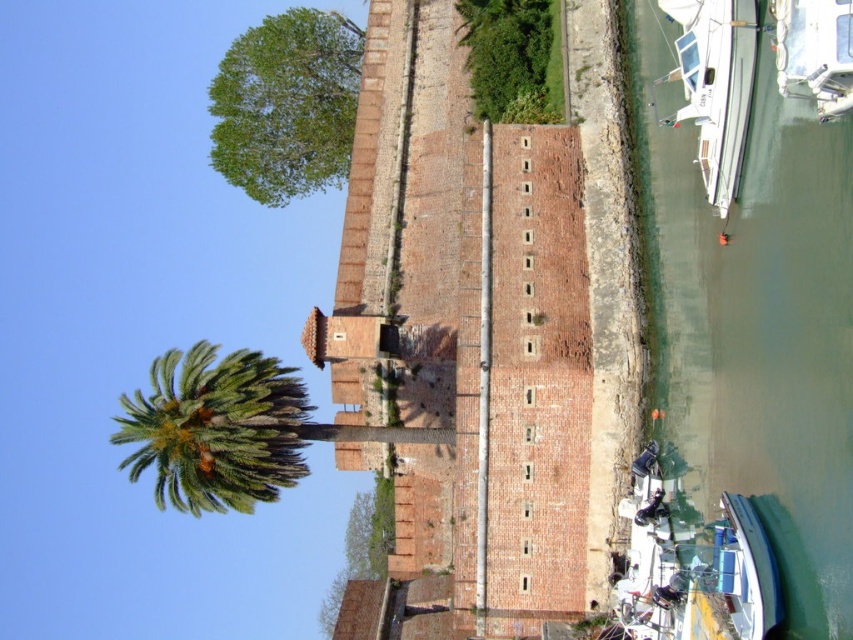
You are a tourist standing on the dock near the historical brick structure. You want to take a photo of the white glossy boat at upper right and the green leafy tree at center in the same frame. Which object should you position closer to the top of your camera view?

The white glossy boat at upper right should be positioned closer to the top of your camera view because it is located above the green leafy tree at center.

You are an architect designing a new park layout. You need to place a bench between the green leafy tree at upper center and the white glossy boat at right. Based on their widths, which object should you place the bench closer to for better spacing?

The green leafy tree at upper center is wider than the white glossy boat at right. Therefore, the bench should be placed closer to the white glossy boat at right to balance the spacing between them.